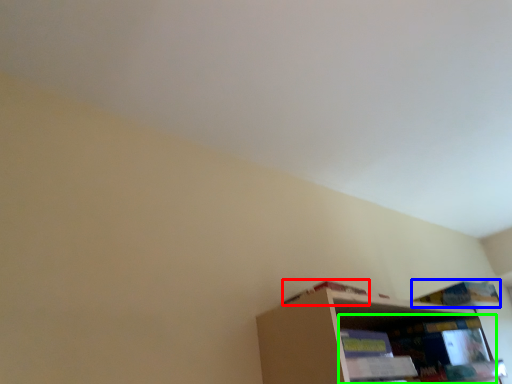
Question: Considering the real-world distances, which object is closest to book (highlighted by a red box)? book (highlighted by a blue box) or shelf (highlighted by a green box).

Choices:
 (A) book
 (B) shelf

Answer: (B)